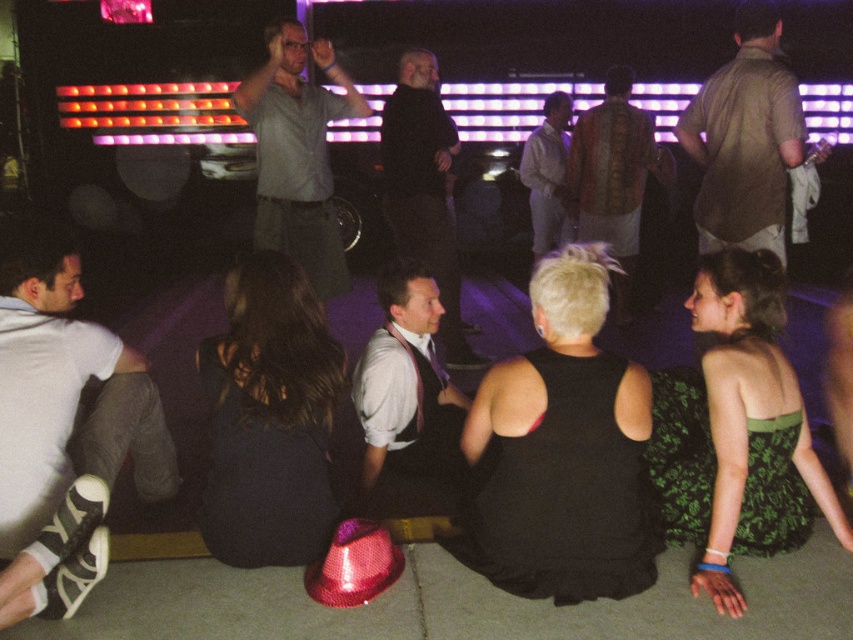
Question: Which object is the closest to the patterned fabric shirt at center?

Choices:
 (A) white satin shirt at center
 (B) green floral dress at lower right
 (C) dark matte suit at center
 (D) white fabric pants at lower left

Answer: (C)

Question: Which object is closer to the camera taking this photo?

Choices:
 (A) black satin dress at center
 (B) light gray shirt at center

Answer: (A)

Question: From the image, what is the correct spatial relationship of black satin dress at center in relation to dark fabric dress at center?

Choices:
 (A) above
 (B) below

Answer: (B)

Question: Is light brown shirt at upper right below white satin shirt at center?

Choices:
 (A) yes
 (B) no

Answer: (B)

Question: Can you confirm if light brown shirt at upper right is wider than white satin shirt at center?

Choices:
 (A) no
 (B) yes

Answer: (B)

Question: Which of the following is the farthest from the observer?

Choices:
 (A) dark matte suit at center
 (B) patterned fabric shirt at center

Answer: (B)